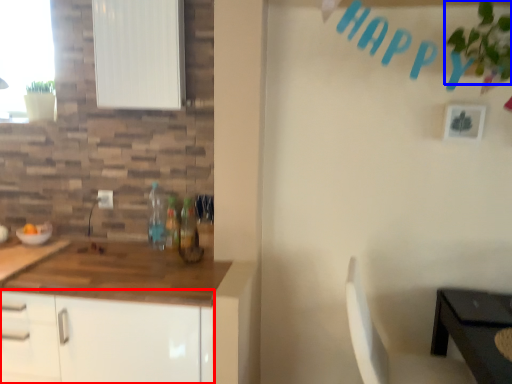
Question: Which point is further to the camera, cabinetry (highlighted by a red box) or plant (highlighted by a blue box)?

Choices:
 (A) cabinetry
 (B) plant

Answer: (A)